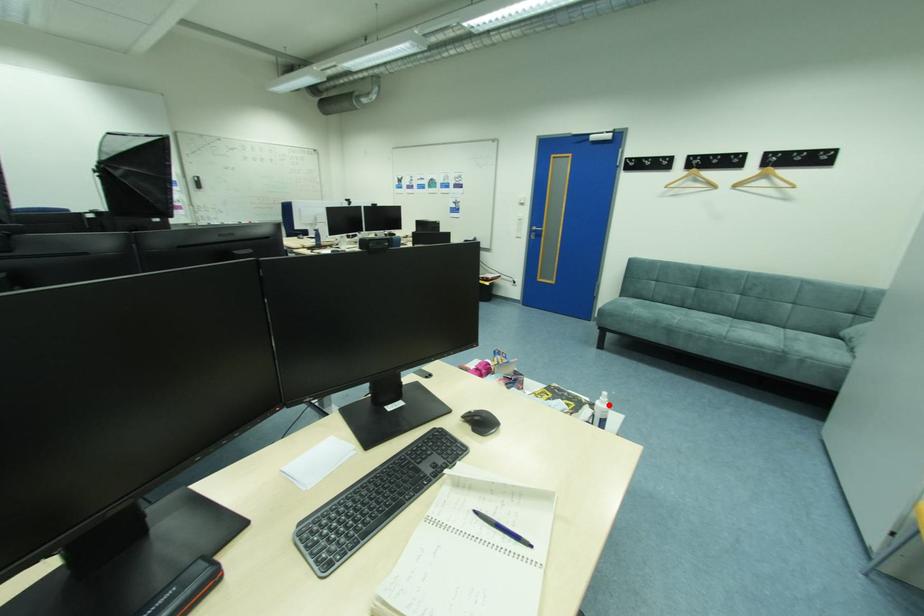
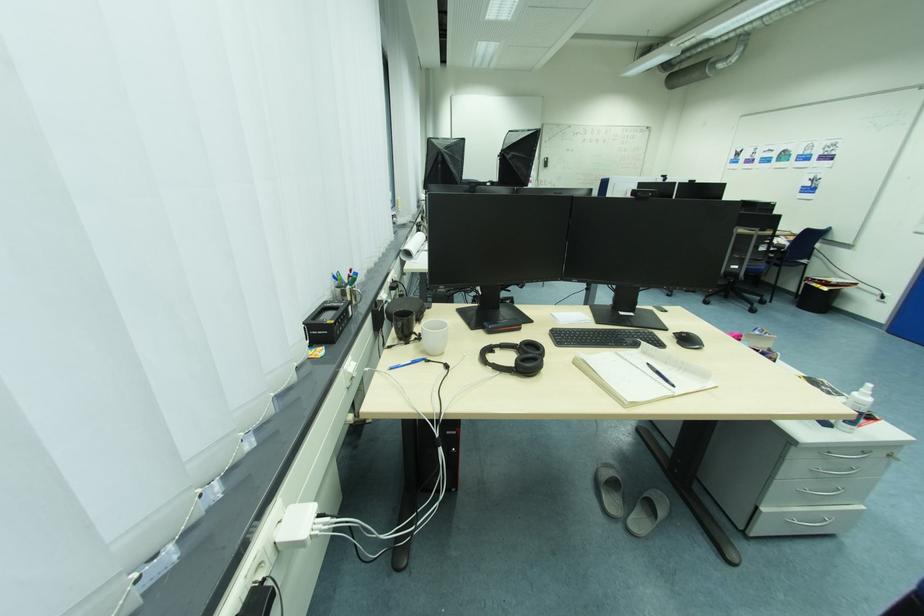
Question: A red point is marked in image1. In image2, is the corresponding 3D point closer to the camera or farther? Reply with the corresponding letter.

Choices:
 (A) The corresponding 3D point is closer.
 (B) The corresponding 3D point is farther.

Answer: (A)